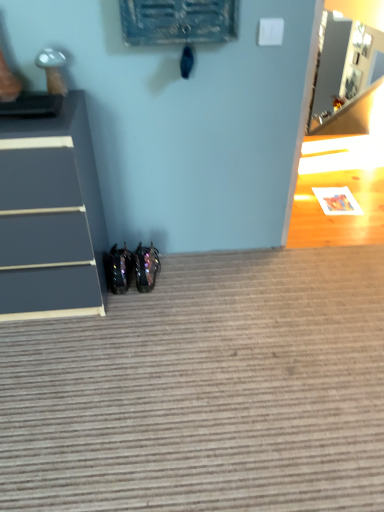
At what (x,y) coordinates should I click in order to perform the action: click on free location in front of glossy black shoes at lower center, which is counted as the 1th footwear, starting from the left. Please return your answer as a coordinate pair (x, y). Looking at the image, I should click on (126, 308).